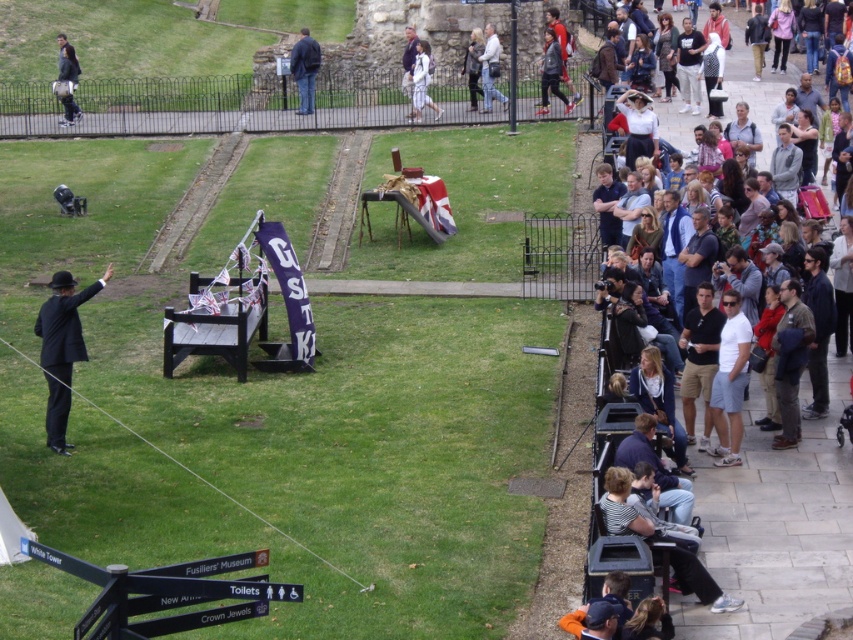
You are a photographer at the event and need to capture a photo that includes both the white cotton dress at center and the light brown leather jacket at upper right. Based on their positions, which object should you focus on first to ensure both are in frame?

The white cotton dress at center is located above the light brown leather jacket at upper right, so you should focus on the white cotton dress at center first to ensure the jacket below it is also captured in the frame.